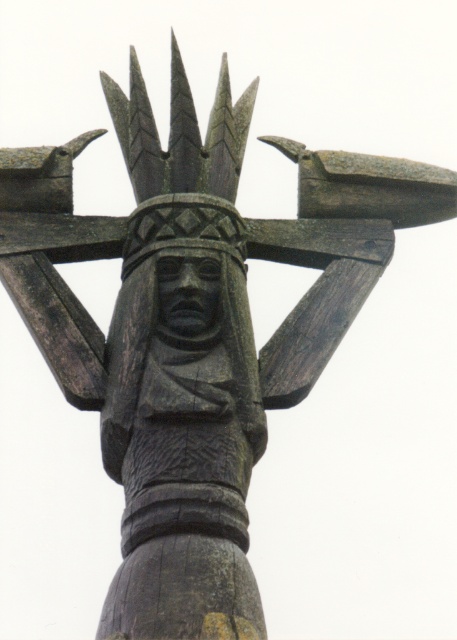
Question: Which point is closer to the camera?

Choices:
 (A) (205, 326)
 (B) (182, 220)

Answer: (A)

Question: Is carved wood head at center above dark wood carving at center?

Choices:
 (A) yes
 (B) no

Answer: (A)

Question: Which of the following is the closest to the observer?

Choices:
 (A) (211, 291)
 (B) (164, 227)

Answer: (A)

Question: Can you confirm if carved wood head at center is positioned to the left of dark wood carving at center?

Choices:
 (A) yes
 (B) no

Answer: (A)

Question: Does carved wood head at center appear under dark wood carving at center?

Choices:
 (A) yes
 (B) no

Answer: (B)